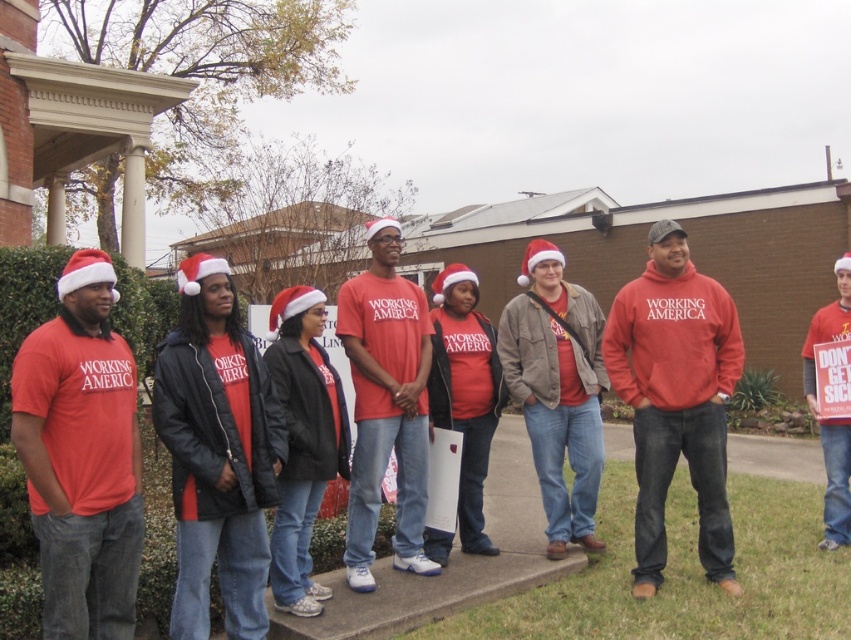
Between matte red t-shirt at center and matte red sweatshirt at center, which one is positioned lower?

Positioned lower is matte red t-shirt at center.

Who is higher up, matte red t-shirt at center or matte red sweatshirt at center?

matte red sweatshirt at center

The height and width of the screenshot is (640, 851). I want to click on matte red t-shirt at center, so (81, 456).

Which is more to the left, matte red t-shirt at center or matte red shirt at center?

Positioned to the left is matte red t-shirt at center.

Looking at this image, who is more distant from viewer, (71, 632) or (387, 353)?

Positioned behind is point (387, 353).

You are a GUI agent. You are given a task and a screenshot of the screen. Output one action in this format:
    pyautogui.click(x=<x>, y=<y>)
    Task: Click on the matte red t-shirt at center
    The width and height of the screenshot is (851, 640).
    Given the screenshot: What is the action you would take?
    pyautogui.click(x=81, y=456)

Can you confirm if matte red shirt at center is positioned above matte red sweatshirt at center?

Yes, matte red shirt at center is above matte red sweatshirt at center.

Between point (426, 353) and point (838, 275), which one is positioned in front?

Point (426, 353) is more forward.

Describe the element at coordinates (386, 404) in the screenshot. I see `matte red shirt at center` at that location.

The width and height of the screenshot is (851, 640). In order to click on matte red shirt at center in this screenshot , I will do `click(386, 404)`.